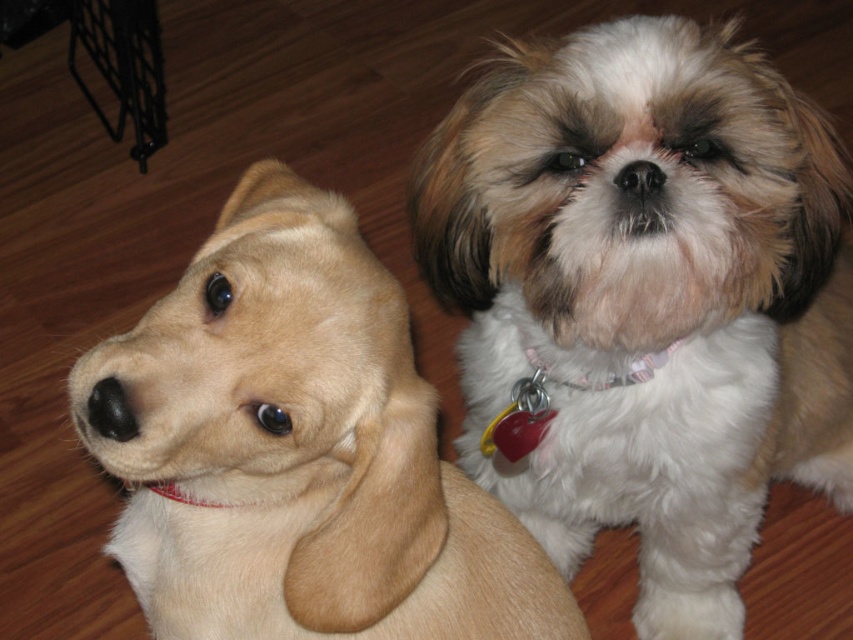
Question: Which object is positioned closest to the black smooth nose at left?

Choices:
 (A) white fluffy dog at upper center
 (B) pink fabric neckband at center
 (C) black fur nose at center
 (D) golden fur puppy at left

Answer: (D)

Question: Can you confirm if golden fur puppy at left is positioned to the left of black smooth nose at left?

Choices:
 (A) yes
 (B) no

Answer: (B)

Question: Can you confirm if white fluffy dog at upper center is smaller than pink fabric neckband at center?

Choices:
 (A) yes
 (B) no

Answer: (B)

Question: Can you confirm if pink fabric neckband at center is wider than black smooth nose at left?

Choices:
 (A) yes
 (B) no

Answer: (A)

Question: Among these points, which one is nearest to the camera?

Choices:
 (A) pyautogui.click(x=370, y=257)
 (B) pyautogui.click(x=97, y=406)
 (C) pyautogui.click(x=608, y=385)
 (D) pyautogui.click(x=817, y=368)

Answer: (B)

Question: Among these points, which one is nearest to the camera?

Choices:
 (A) (624, 166)
 (B) (90, 412)
 (C) (648, 419)

Answer: (B)